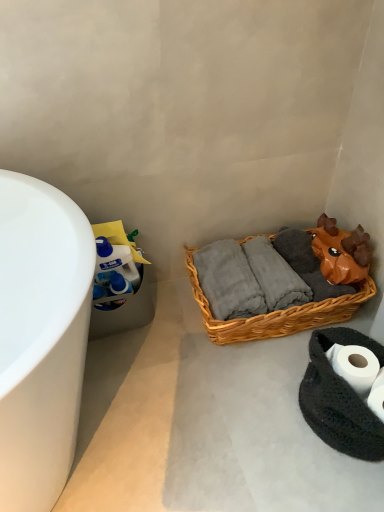
Question: From a real-world perspective, is black knitted rug at lower right beneath woven brown basket at center?

Choices:
 (A) yes
 (B) no

Answer: (A)

Question: Is black knitted rug at lower right located outside woven brown basket at center?

Choices:
 (A) yes
 (B) no

Answer: (A)

Question: Is black knitted rug at lower right at the right side of woven brown basket at center?

Choices:
 (A) yes
 (B) no

Answer: (A)

Question: Is black knitted rug at lower right looking in the opposite direction of woven brown basket at center?

Choices:
 (A) yes
 (B) no

Answer: (B)

Question: Is black knitted rug at lower right not near woven brown basket at center?

Choices:
 (A) no
 (B) yes

Answer: (A)

Question: From the image's perspective, is black knitted rug at lower right on woven brown basket at center?

Choices:
 (A) no
 (B) yes

Answer: (A)

Question: Does woven brown basket at center have a greater height compared to black knitted rug at lower right?

Choices:
 (A) yes
 (B) no

Answer: (A)

Question: From a real-world perspective, is woven brown basket at center positioned under black knitted rug at lower right based on gravity?

Choices:
 (A) yes
 (B) no

Answer: (B)

Question: Does woven brown basket at center come behind black knitted rug at lower right?

Choices:
 (A) yes
 (B) no

Answer: (A)

Question: Is woven brown basket at center to the right of black knitted rug at lower right from the viewer's perspective?

Choices:
 (A) yes
 (B) no

Answer: (B)

Question: Does woven brown basket at center have a lesser width compared to black knitted rug at lower right?

Choices:
 (A) no
 (B) yes

Answer: (A)

Question: Is woven brown basket at center bigger than black knitted rug at lower right?

Choices:
 (A) yes
 (B) no

Answer: (A)

Question: Is black knitted rug at lower right with white matte toilet paper at lower right?

Choices:
 (A) yes
 (B) no

Answer: (A)